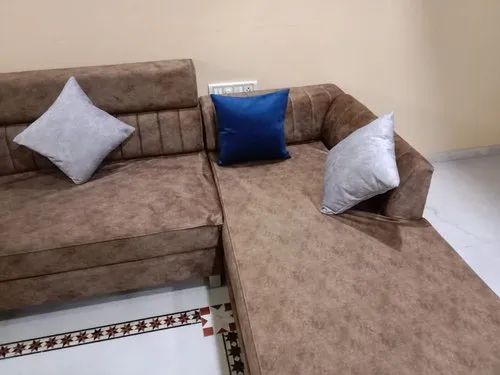
The image size is (500, 375). I want to click on sectional couch, so click(x=176, y=157).